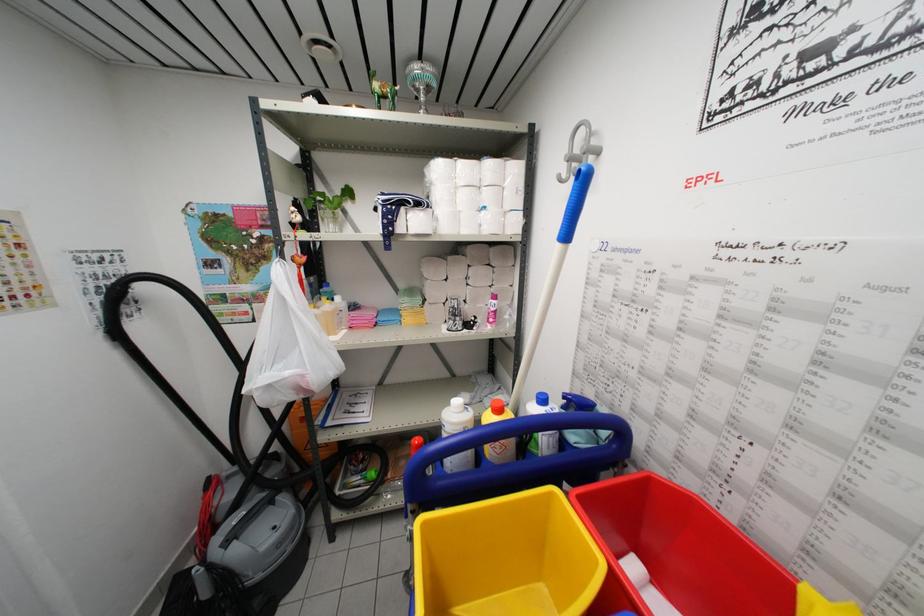
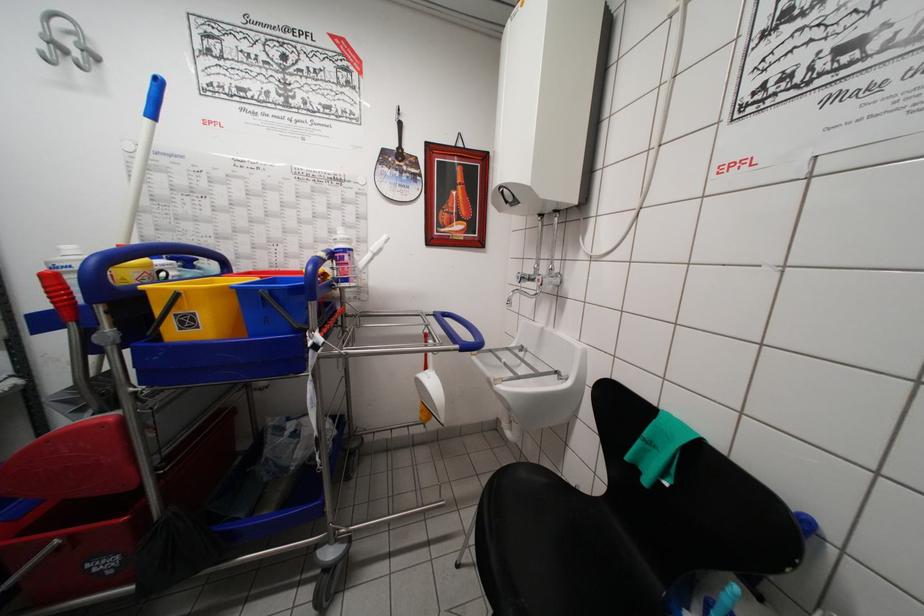
Locate, in the second image, the point that corresponds to point (563, 249) in the first image.

(151, 124)